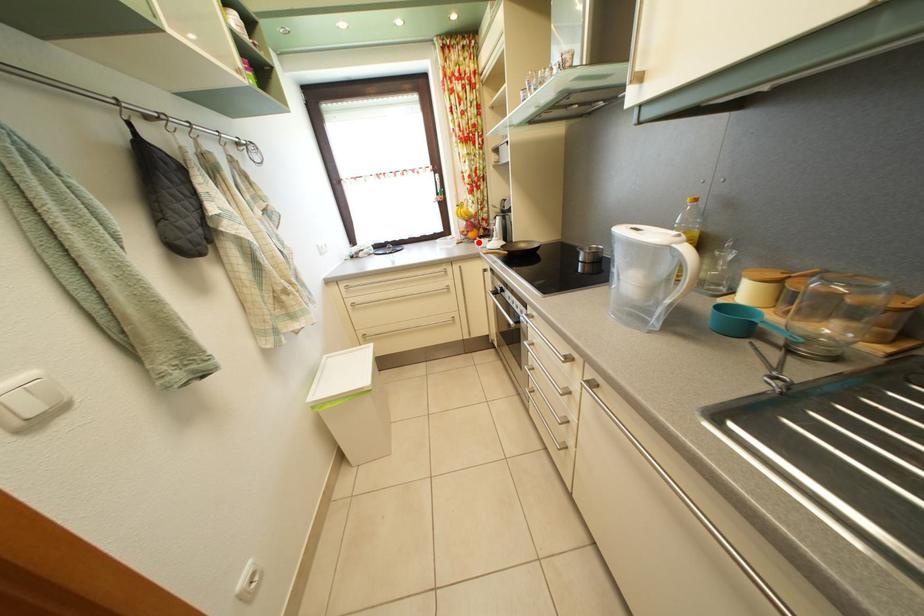
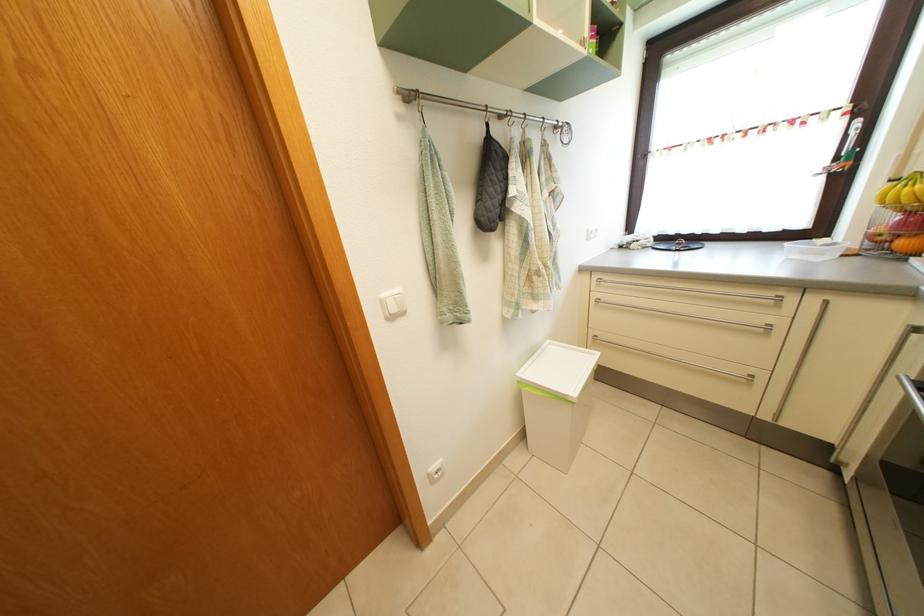
In the second image, find the point that corresponds to the highlighted location in the first image.

(910, 252)